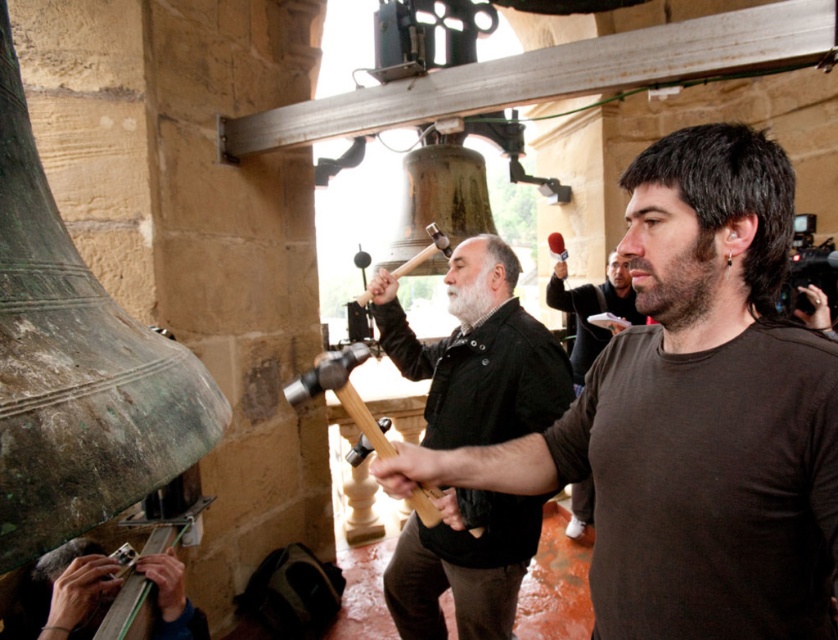
You are a visitor in the bell tower and want to take a photo of both the dark brown leather jacket at center and the white matte beard at center. Since your camera has a fixed frame, you need to know which object is wider to ensure both fit. Which one is wider?

The dark brown leather jacket at center is wider than the white matte beard at center, so you should position the camera to accommodate its width to include both in the frame.

You are a visitor in the bell tower and you see the dark brown leather jacket at center and the dark brown beard at center. Which one is taller?

The dark brown leather jacket at center is much taller than the dark brown beard at center.

You are standing in the bell tower and see the dark brown leather jacket at center and the white matte beard at center. Which object is nearer to you?

The dark brown leather jacket at center is closer to the viewer than the white matte beard at center.